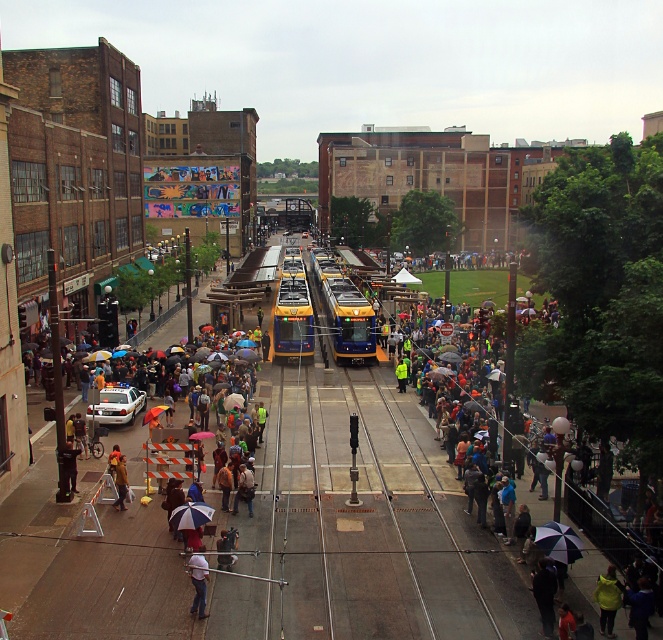
Consider the image. You are a photographer trying to capture a clear shot of the white matte shirt at lower center and the blue fabric umbrella at lower center. Since you want the shirt to be the main focus, which object should you zoom in on to ensure it appears larger in the photo?

The white matte shirt at lower center is thinner than the blue fabric umbrella at lower center, so to make the shirt appear larger in the photo, you should zoom in on the white matte shirt at lower center.

You are standing at the entrance of the station and want to locate the blue fabric umbrella at lower center. According to the coordinates provided, in which direction should you move from your current position to reach it?

The blue fabric umbrella at lower center is located at coordinates 0.806 on the x axis and 0.288 on the y axis. Since you are at the entrance, moving towards the lower center area of the image would lead you to the umbrella.

You are standing at the point marked by the coordinates in the image. Looking around, you see a crowd of people in the bustling urban scene. Can you identify what is located at the coordinates point (198, 580)?

The coordinates point (198, 580) marks the location of the white matte shirt at lower center.